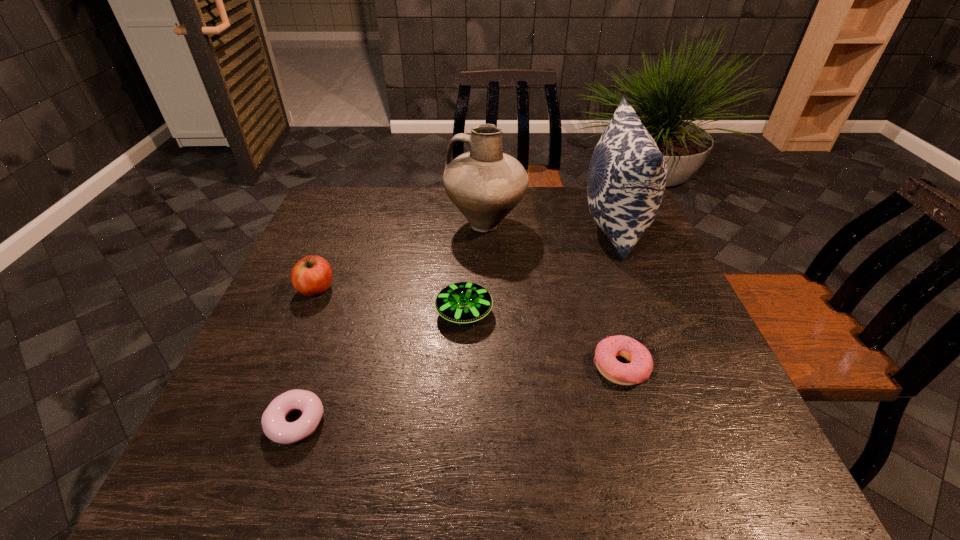
The height and width of the screenshot is (540, 960). I want to click on object at the near edge, so click(x=275, y=427).

Locate an element on the screen. apple positioned at the left edge is located at coordinates (312, 275).

What are the coordinates of `doughnut that is at the left edge` in the screenshot? It's located at (275, 427).

In order to click on cushion that is at the right edge in this screenshot , I will do `click(627, 174)`.

The height and width of the screenshot is (540, 960). I want to click on doughnut that is at the right edge, so click(x=639, y=369).

Where is `object present at the near left corner`? object present at the near left corner is located at coordinates (275, 427).

Where is `object present at the far right corner`? The height and width of the screenshot is (540, 960). object present at the far right corner is located at coordinates (627, 174).

In the image, there is a desktop. Identify the location of vacant space at the far edge. This screenshot has width=960, height=540. (510, 227).

The image size is (960, 540). I want to click on vacant area at the near edge of the desktop, so click(x=647, y=492).

I want to click on vacant region at the left edge of the desktop, so click(x=305, y=360).